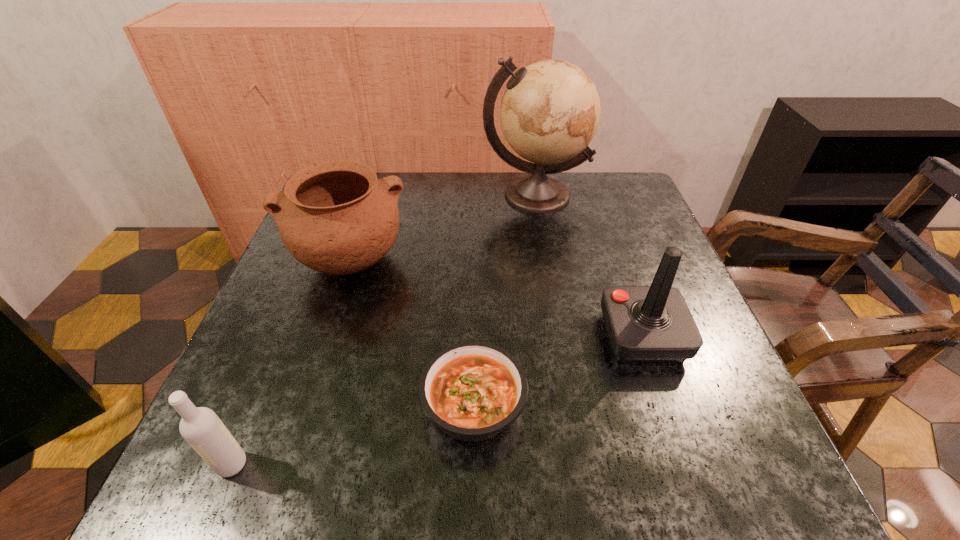
In order to click on vacant area between the joystick and the shortest object in this screenshot , I will do [558, 370].

Where is `free space between the pottery and the joystick`? The image size is (960, 540). free space between the pottery and the joystick is located at coordinates (495, 299).

Image resolution: width=960 pixels, height=540 pixels. Find the location of `empty space between the pottery and the shortest object`. empty space between the pottery and the shortest object is located at coordinates (411, 333).

Where is `free space between the globe and the joystick`? free space between the globe and the joystick is located at coordinates (588, 266).

You are a GUI agent. You are given a task and a screenshot of the screen. Output one action in this format:
    pyautogui.click(x=<x>, y=<y>)
    Task: Click on the free area in between the shortest object and the pottery
    This screenshot has width=960, height=540.
    Given the screenshot: What is the action you would take?
    pyautogui.click(x=411, y=333)

What are the coordinates of `object identified as the third closest to the joystick` in the screenshot? It's located at (335, 217).

Find the location of a particular element. The width and height of the screenshot is (960, 540). object that is the second closest to the vodka is located at coordinates (335, 217).

The width and height of the screenshot is (960, 540). Find the location of `free location that satisfies the following two spatial constraints: 1. on the front side of the fourth nearest object; 2. on the left side of the joystick`. free location that satisfies the following two spatial constraints: 1. on the front side of the fourth nearest object; 2. on the left side of the joystick is located at coordinates (324, 336).